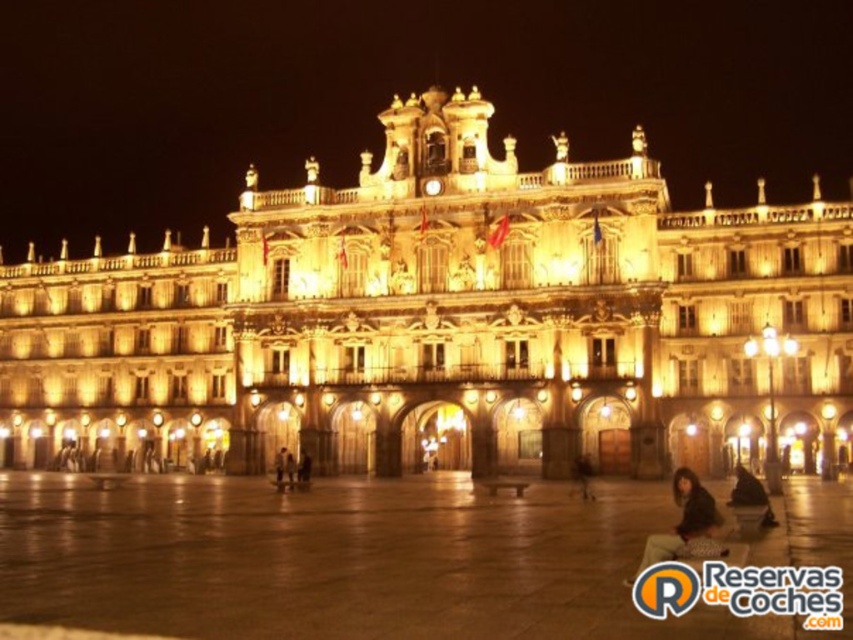
Question: Where is golden stone building at center located in relation to dark brown hair at lower right in the image?

Choices:
 (A) right
 (B) left

Answer: (B)

Question: Which object is farther from the camera taking this photo?

Choices:
 (A) dark brown hair at lower right
 (B) dark fabric bag at lower right
 (C) golden stone building at center

Answer: (C)

Question: Which object appears closest to the camera in this image?

Choices:
 (A) dark fabric bag at lower right
 (B) dark brown hair at lower right
 (C) golden stone building at center

Answer: (B)

Question: Does golden stone building at center have a larger size compared to dark fabric bag at lower right?

Choices:
 (A) yes
 (B) no

Answer: (A)

Question: Is the position of golden stone building at center more distant than that of dark fabric bag at lower right?

Choices:
 (A) no
 (B) yes

Answer: (B)

Question: Among these objects, which one is nearest to the camera?

Choices:
 (A) golden stone building at center
 (B) dark fabric bag at lower right

Answer: (B)